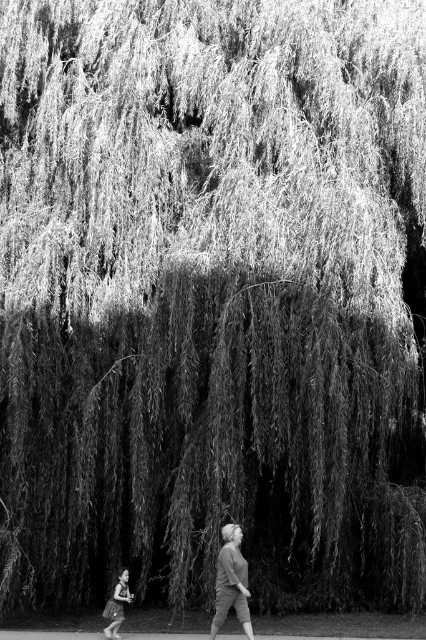
Question: Considering the relative positions of matte gray sweater at center and smooth skin child at lower left in the image provided, where is matte gray sweater at center located with respect to smooth skin child at lower left?

Choices:
 (A) above
 (B) below

Answer: (A)

Question: Is matte gray sweater at center closer to camera compared to smooth skin child at lower left?

Choices:
 (A) no
 (B) yes

Answer: (B)

Question: Which of the following is the closest to the observer?

Choices:
 (A) (250, 632)
 (B) (118, 620)

Answer: (A)

Question: Among these points, which one is nearest to the camera?

Choices:
 (A) (112, 602)
 (B) (247, 579)

Answer: (B)

Question: Which point is farther from the camera taking this photo?

Choices:
 (A) (247, 605)
 (B) (121, 618)

Answer: (B)

Question: Does matte gray sweater at center appear under smooth skin child at lower left?

Choices:
 (A) no
 (B) yes

Answer: (A)